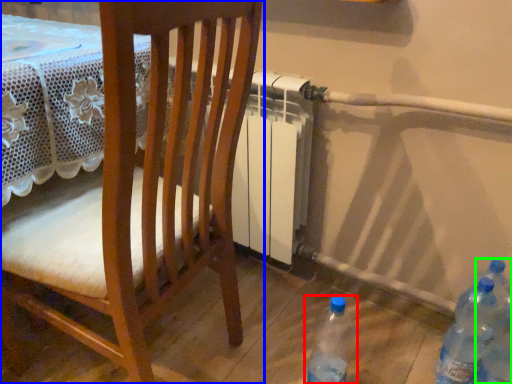
Question: Considering the real-world distances, which object is farthest from bottle (highlighted by a red box)? chair (highlighted by a blue box) or bottle (highlighted by a green box)?

Choices:
 (A) chair
 (B) bottle

Answer: (A)